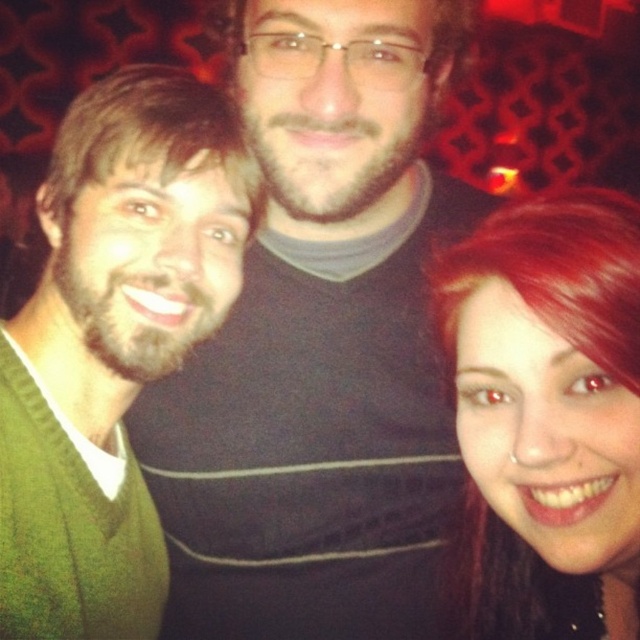
Which is above, green knitted sweater at left or shiny red hair at center?

Positioned higher is green knitted sweater at left.

Who is positioned more to the left, green knitted sweater at left or shiny red hair at center?

From the viewer's perspective, green knitted sweater at left appears more on the left side.

Find the location of `green knitted sweater at left`. green knitted sweater at left is located at coordinates (112, 342).

Is the position of matte black shirt at center more distant than that of green knitted sweater at left?

Yes, it is behind green knitted sweater at left.

Is matte black shirt at center below green knitted sweater at left?

Actually, matte black shirt at center is above green knitted sweater at left.

Is point (436, 196) closer to viewer compared to point (180, 237)?

No, (436, 196) is behind (180, 237).

Where is `matte black shirt at center`? matte black shirt at center is located at coordinates (321, 342).

Which is above, matte black shirt at center or shiny red hair at center?

Positioned higher is matte black shirt at center.

Can you confirm if matte black shirt at center is positioned to the right of shiny red hair at center?

Incorrect, matte black shirt at center is not on the right side of shiny red hair at center.

This screenshot has width=640, height=640. Describe the element at coordinates (321, 342) in the screenshot. I see `matte black shirt at center` at that location.

Where is `matte black shirt at center`? matte black shirt at center is located at coordinates (321, 342).